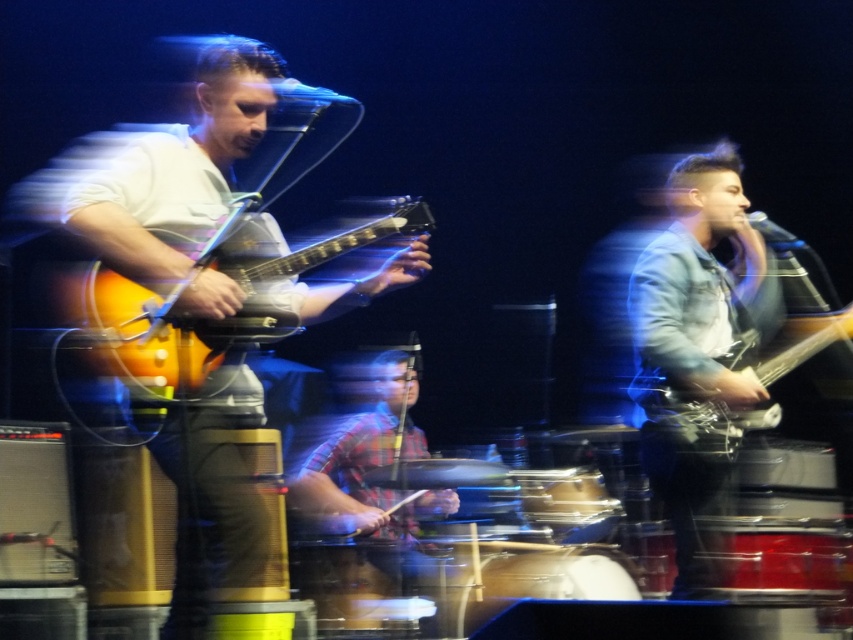
Question: Is matte orange guitar at left closer to the viewer compared to matte black guitar at right?

Choices:
 (A) no
 (B) yes

Answer: (B)

Question: Which point is farther to the camera?

Choices:
 (A) (x=258, y=124)
 (B) (x=778, y=376)
 (C) (x=593, y=548)

Answer: (C)

Question: Which is farther from the smooth brown drum at center?

Choices:
 (A) matte orange guitar at left
 (B) matte black guitar at right
 (C) shiny metallic drum at center

Answer: (A)

Question: Can you confirm if matte black guitar at right is wider than smooth brown drum at center?

Choices:
 (A) no
 (B) yes

Answer: (B)

Question: Based on their relative distances, which object is farther from the matte orange guitar at left?

Choices:
 (A) matte black guitar at right
 (B) matte orange electric guitar at left
 (C) shiny metallic drum at center
 (D) smooth brown drum at center

Answer: (A)

Question: Is smooth brown drum at center positioned at the back of shiny metallic drum at center?

Choices:
 (A) no
 (B) yes

Answer: (A)